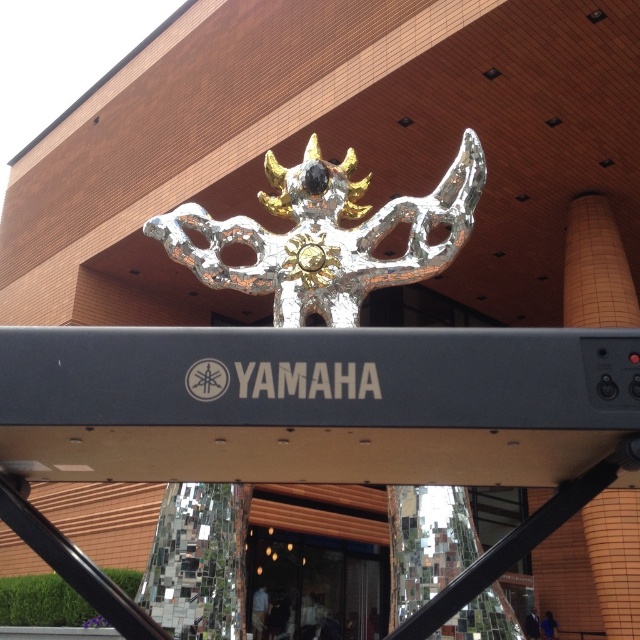
You are a delivery person standing at the entrance of the Yamaha facility. You need to place a package that requires a distance of at least 60 feet between the delivery point and the transparent glass door at lower center. Can you place the package near the shiny silver sculpture at center?

The shiny silver sculpture at center is 61.03 feet away from the transparent glass door at lower center. Since 61.03 feet is more than the required 60 feet, you can safely place the package near the shiny silver sculpture at center.